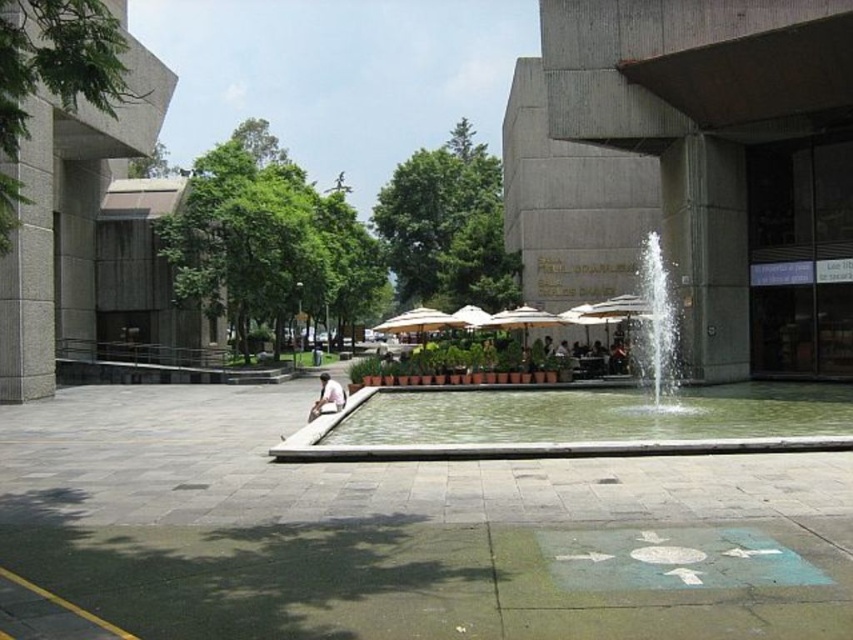
You are a city planner assessing the plaza layout. You need to determine if the green concrete water at center can be entirely contained within the green concrete fountain at center. Based on their sizes, what is your conclusion?

The green concrete fountain at center has a larger size compared to green concrete water at center. Therefore, the green concrete water at center can be entirely contained within the green concrete fountain at center.

You are a city planner assessing the plaza layout. You need to ensure that the green concrete fountain at center and the green concrete water at center are visible from the main entrance path. Considering their heights, which object might block the view of the other when viewed from the entrance?

The green concrete fountain at center has a greater height compared to the green concrete water at center. Therefore, the fountain could potentially block the view of the water from the entrance path.

You are a maintenance worker inspecting the plaza. You notice the green concrete fountain at center and the green concrete water at center. Which one is located above the other?

The green concrete fountain at center is positioned over green concrete water at center.